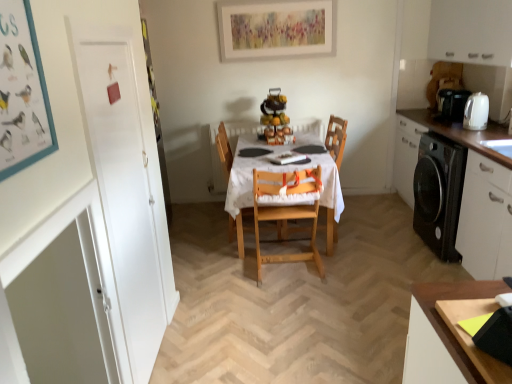
Question: Is wooden table at center wider than natural wood highchair at center, the 1th chair when ordered from front to back?

Choices:
 (A) no
 (B) yes

Answer: (B)

Question: Is wooden table at center facing towards natural wood highchair at center, the 2th chair positioned from the back?

Choices:
 (A) no
 (B) yes

Answer: (B)

Question: Is wooden table at center oriented away from natural wood highchair at center, the 1th chair when ordered from front to back?

Choices:
 (A) yes
 (B) no

Answer: (B)

Question: Does wooden table at center appear on the left side of natural wood highchair at center, the 2th chair positioned from the back?

Choices:
 (A) yes
 (B) no

Answer: (A)

Question: Does wooden table at center lie in front of natural wood highchair at center, the 1th chair when ordered from front to back?

Choices:
 (A) yes
 (B) no

Answer: (B)

Question: In terms of height, does wooden chair at center, the first chair positioned from the back, look taller or shorter compared to natural wood highchair at center, the 1th chair when ordered from front to back?

Choices:
 (A) tall
 (B) short

Answer: (A)

Question: In the image, is wooden chair at center, positioned as the second chair in front-to-back order, positioned in front of or behind natural wood highchair at center, the 2th chair positioned from the back?

Choices:
 (A) behind
 (B) front

Answer: (A)

Question: Looking at the image, does wooden chair at center, positioned as the second chair in front-to-back order, seem bigger or smaller compared to natural wood highchair at center, the 1th chair when ordered from front to back?

Choices:
 (A) small
 (B) big

Answer: (B)

Question: From a real-world perspective, relative to natural wood highchair at center, the 1th chair when ordered from front to back, is wooden chair at center, positioned as the second chair in front-to-back order, vertically above or below?

Choices:
 (A) below
 (B) above

Answer: (B)

Question: In terms of width, does white matte cabinet at right, the 2th cabinetry in the top-to-bottom sequence, look wider or thinner when compared to black plastic coffee machine at right?

Choices:
 (A) wide
 (B) thin

Answer: (A)

Question: From the image's perspective, is white matte cabinet at right, which appears as the 1th cabinetry when ordered from the bottom, above or below black plastic coffee machine at right?

Choices:
 (A) below
 (B) above

Answer: (A)

Question: From a real-world perspective, is white matte cabinet at right, which appears as the 1th cabinetry when ordered from the bottom, physically located above or below black plastic coffee machine at right?

Choices:
 (A) above
 (B) below

Answer: (B)

Question: Is white matte cabinet at right, which appears as the 1th cabinetry when ordered from the bottom, in front of or behind black plastic coffee machine at right in the image?

Choices:
 (A) front
 (B) behind

Answer: (A)

Question: From a real-world perspective, is wooden table at center above or below natural wood highchair at center, the 2th chair positioned from the back?

Choices:
 (A) below
 (B) above

Answer: (A)

Question: Is wooden table at center inside or outside of natural wood highchair at center, the 1th chair when ordered from front to back?

Choices:
 (A) outside
 (B) inside

Answer: (A)